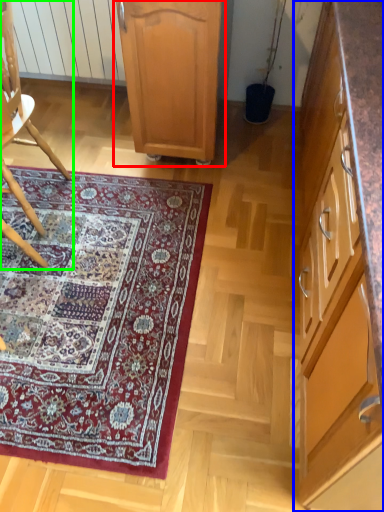
Question: Based on their relative distances, which object is nearer to cabinetry (highlighted by a red box)? Choose from cabinetry (highlighted by a blue box) and chair (highlighted by a green box).

Choices:
 (A) cabinetry
 (B) chair

Answer: (B)